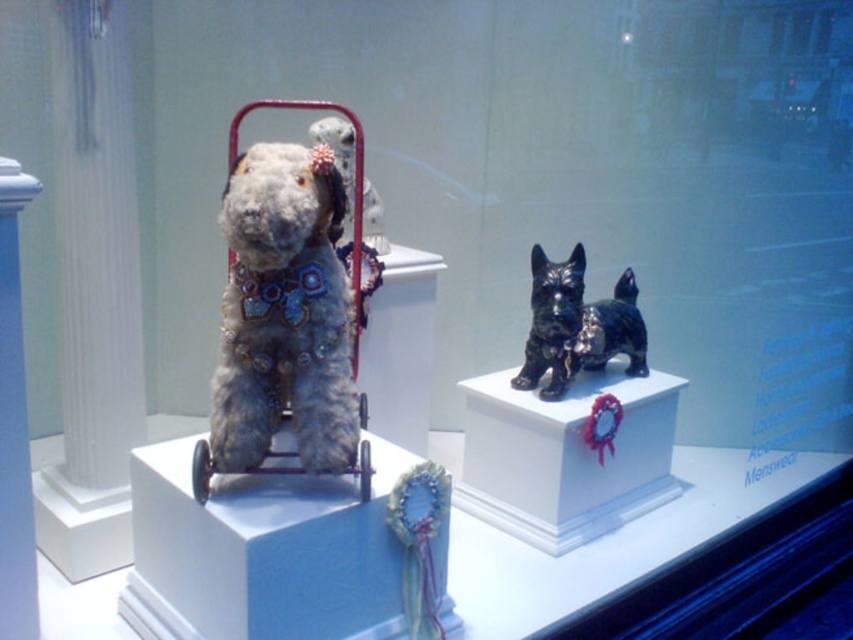
Can you confirm if fuzzy fabric dog at center is shorter than shiny black figurine at center?

No, fuzzy fabric dog at center is not shorter than shiny black figurine at center.

Is point (268, 209) behind point (579, 353)?

No.

This screenshot has height=640, width=853. In order to click on fuzzy fabric dog at center in this screenshot , I will do `click(283, 312)`.

Consider the image. Does shiny blue ribbon at center have a lesser height compared to fuzzy fabric dog stroller at upper center?

Yes.

The image size is (853, 640). Find the location of `shiny blue ribbon at center`. shiny blue ribbon at center is located at coordinates (419, 541).

Is point (438, 605) farther from camera compared to point (352, 228)?

No, (438, 605) is in front of (352, 228).

Locate an element on the screen. The width and height of the screenshot is (853, 640). shiny blue ribbon at center is located at coordinates (419, 541).

Is fuzzy fabric dog at center above shiny blue ribbon at center?

Indeed, fuzzy fabric dog at center is positioned over shiny blue ribbon at center.

Does fuzzy fabric dog at center have a smaller size compared to shiny blue ribbon at center?

No.

This screenshot has height=640, width=853. I want to click on fuzzy fabric dog at center, so click(x=283, y=312).